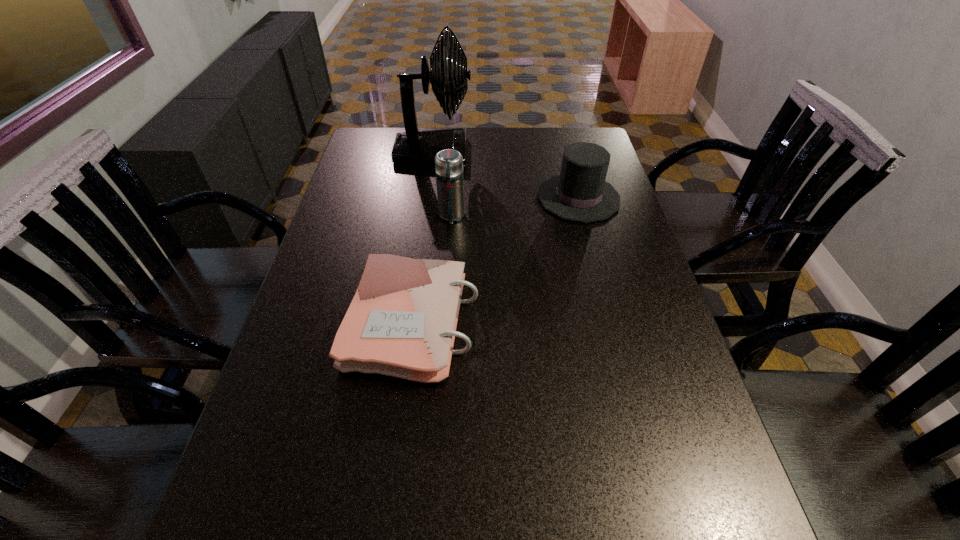
At what (x,y) coordinates should I click in order to perform the action: click on vacant space at the far left corner. Please return your answer as a coordinate pair (x, y). This screenshot has width=960, height=540. Looking at the image, I should click on (396, 133).

Where is `free spot at the far right corner of the desktop`? The image size is (960, 540). free spot at the far right corner of the desktop is located at coordinates (585, 135).

Image resolution: width=960 pixels, height=540 pixels. Find the location of `vacant space that is in between the dress hat and the fan`. vacant space that is in between the dress hat and the fan is located at coordinates (506, 176).

I want to click on free spot between the shortest object and the tallest object, so click(x=423, y=238).

Where is `free area in between the tallest object and the rightmost object`? This screenshot has width=960, height=540. free area in between the tallest object and the rightmost object is located at coordinates (506, 176).

Point out which object is positioned as the nearest to the tallest object. Please provide its 2D coordinates. Your answer should be formatted as a tuple, i.e. [(x, y)], where the tuple contains the x and y coordinates of a point satisfying the conditions above.

[(448, 163)]

Identify the location of object that can be found as the closest to the thermos bottle. This screenshot has height=540, width=960. (416, 147).